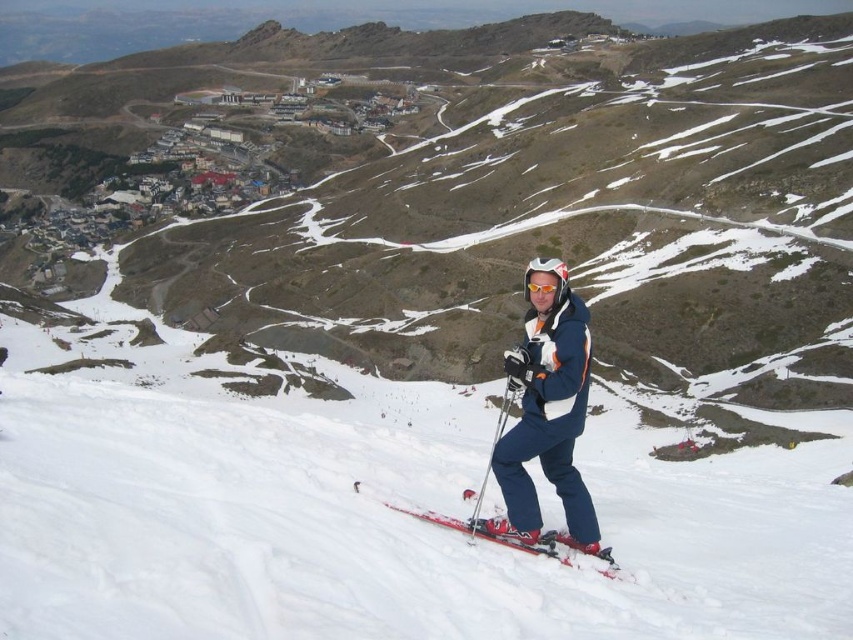
Which is in front, point (550, 364) or point (579, 554)?

Point (579, 554) is in front.

Find the location of `blue fabric ski suit at center`. blue fabric ski suit at center is located at coordinates (547, 413).

Where is `blue fabric ski suit at center`? blue fabric ski suit at center is located at coordinates (547, 413).

The image size is (853, 640). What do you see at coordinates (495, 532) in the screenshot? I see `red matte skis at center` at bounding box center [495, 532].

Where is `red matte skis at center`? Image resolution: width=853 pixels, height=640 pixels. red matte skis at center is located at coordinates (495, 532).

Does blue fabric ski suit at center have a larger size compared to orange reflective goggles at center?

Indeed, blue fabric ski suit at center has a larger size compared to orange reflective goggles at center.

Between point (566, 456) and point (548, 285), which one is positioned behind?

The point (548, 285) is behind.

The width and height of the screenshot is (853, 640). Find the location of `blue fabric ski suit at center`. blue fabric ski suit at center is located at coordinates (547, 413).